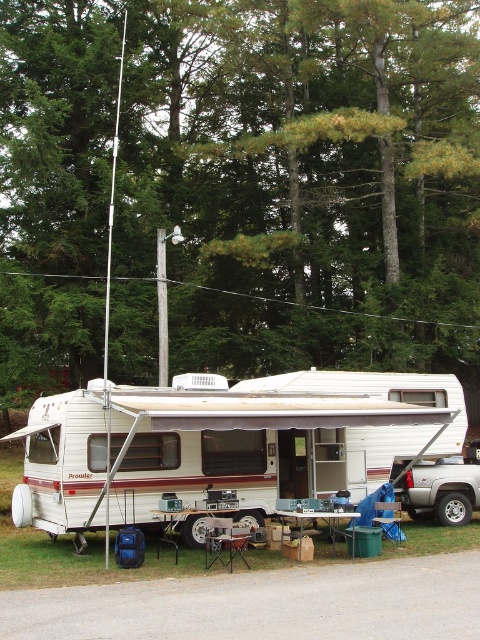
Which of these two, silver metallic truck at lower right or wooden picnic table at center, stands shorter?

Standing shorter between the two is wooden picnic table at center.

Does silver metallic truck at lower right have a lesser width compared to wooden picnic table at center?

In fact, silver metallic truck at lower right might be wider than wooden picnic table at center.

At what (x,y) coordinates should I click in order to perform the action: click on silver metallic truck at lower right. Please return your answer as a coordinate pair (x, y). Looking at the image, I should click on tap(437, 488).

Looking at this image, who is higher up, white vinyl camper at center or green plastic picnic table at lower center?

white vinyl camper at center is higher up.

Which is in front, point (118, 426) or point (177, 522)?

Point (177, 522) is in front.

You are a GUI agent. You are given a task and a screenshot of the screen. Output one action in this format:
    pyautogui.click(x=<x>, y=<y>)
    Task: Click on the white vinyl camper at center
    The width and height of the screenshot is (480, 640).
    Given the screenshot: What is the action you would take?
    (x=273, y=436)

Looking at this image, which is above, green leafy tree at upper center or green plastic picnic table at lower center?

green leafy tree at upper center is above.

Who is shorter, green leafy tree at upper center or green plastic picnic table at lower center?

green plastic picnic table at lower center is shorter.

Where is `green leafy tree at upper center`? green leafy tree at upper center is located at coordinates (240, 186).